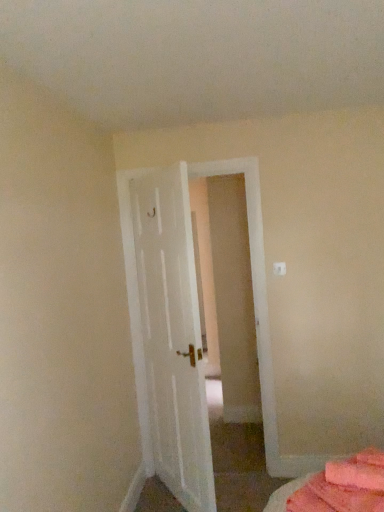
Describe the element at coordinates (135, 325) in the screenshot. I see `white painted wood door at center` at that location.

This screenshot has height=512, width=384. I want to click on white painted wood door at center, so click(135, 325).

What is the approximate height of white painted wood door at center?

white painted wood door at center is 6.88 feet tall.

What is the approximate width of pink fabric bed at lower right?

It is 11.65 inches.

Identify the location of pink fabric bed at lower right. This screenshot has width=384, height=512. (344, 486).

What do you see at coordinates (344, 486) in the screenshot? I see `pink fabric bed at lower right` at bounding box center [344, 486].

Measure the distance between point (345, 463) and camera.

The distance of point (345, 463) from camera is 1.49 meters.

At what (x,y) coordinates should I click in order to perform the action: click on white painted wood door at center. Please return your answer as a coordinate pair (x, y). The width and height of the screenshot is (384, 512). Looking at the image, I should click on (135, 325).

Which object is positioned more to the left, white painted wood door at center or pink fabric bed at lower right?

white painted wood door at center.

Considering the positions of objects white painted wood door at center and pink fabric bed at lower right in the image provided, who is behind, white painted wood door at center or pink fabric bed at lower right?

white painted wood door at center is behind.

Is point (215, 164) less distant than point (382, 487)?

No.

From the image's perspective, which is below, white painted wood door at center or pink fabric bed at lower right?

pink fabric bed at lower right is shown below in the image.

From a real-world perspective, is white painted wood door at center below pink fabric bed at lower right?

No.

Does white painted wood door at center have a greater width compared to pink fabric bed at lower right?

No.

In the scene shown: Considering the sizes of objects white painted wood door at center and pink fabric bed at lower right in the image provided, who is shorter, white painted wood door at center or pink fabric bed at lower right?

pink fabric bed at lower right is shorter.

Between white painted wood door at center and pink fabric bed at lower right, which one has smaller size?

With smaller size is pink fabric bed at lower right.

Is white painted wood door at center inside or outside of pink fabric bed at lower right?

white painted wood door at center is not inside pink fabric bed at lower right, it's outside.

From the picture: Is white painted wood door at center positioned far away from pink fabric bed at lower right?

white painted wood door at center is far away from pink fabric bed at lower right.

Is white painted wood door at center looking in the opposite direction of pink fabric bed at lower right?

No, white painted wood door at center's orientation is not away from pink fabric bed at lower right.

How distant is white painted wood door at center from pink fabric bed at lower right?

white painted wood door at center and pink fabric bed at lower right are 5.38 feet apart from each other.

You are a GUI agent. You are given a task and a screenshot of the screen. Output one action in this format:
    pyautogui.click(x=<x>, y=<y>)
    Task: Click on the bed below the white painted wood door at center (from the image's perspective)
    This screenshot has height=512, width=384.
    Given the screenshot: What is the action you would take?
    pyautogui.click(x=344, y=486)

Which is more to the right, pink fabric bed at lower right or white painted wood door at center?

Positioned to the right is pink fabric bed at lower right.

Consider the image. Relative to white painted wood door at center, is pink fabric bed at lower right in front or behind?

pink fabric bed at lower right is positioned closer to the viewer than white painted wood door at center.

Does point (356, 496) come closer to viewer compared to point (130, 492)?

Yes, point (356, 496) is in front of point (130, 492).

From the image's perspective, is pink fabric bed at lower right on top of white painted wood door at center?

No, from the image's perspective, pink fabric bed at lower right is not on top of white painted wood door at center.

From a real-world perspective, does pink fabric bed at lower right stand above white painted wood door at center?

No, from a real-world perspective, pink fabric bed at lower right is not over white painted wood door at center

Does pink fabric bed at lower right have a greater width compared to white painted wood door at center?

Yes.

In terms of height, does pink fabric bed at lower right look taller or shorter compared to white painted wood door at center?

Considering their sizes, pink fabric bed at lower right has less height than white painted wood door at center.

Considering the sizes of pink fabric bed at lower right and white painted wood door at center in the image, is pink fabric bed at lower right bigger or smaller than white painted wood door at center?

pink fabric bed at lower right is smaller than white painted wood door at center.

Is white painted wood door at center inside pink fabric bed at lower right?

No.

Is pink fabric bed at lower right directly adjacent to white painted wood door at center?

No, pink fabric bed at lower right is not touching white painted wood door at center.

Is white painted wood door at center at the back of pink fabric bed at lower right?

pink fabric bed at lower right is not turned away from white painted wood door at center.

How many degrees apart are the facing directions of pink fabric bed at lower right and white painted wood door at center?

The facing directions of pink fabric bed at lower right and white painted wood door at center are 142 degrees apart.

Measure the distance between pink fabric bed at lower right and white painted wood door at center.

pink fabric bed at lower right is 5.38 feet from white painted wood door at center.

At what (x,y) coordinates should I click in order to perform the action: click on bed on the right side of white painted wood door at center. Please return your answer as a coordinate pair (x, y). Looking at the image, I should click on (344, 486).

This screenshot has height=512, width=384. What are the coordinates of `bed directly beneath the white painted wood door at center (from a real-world perspective)` in the screenshot? It's located at (344, 486).

You are a GUI agent. You are given a task and a screenshot of the screen. Output one action in this format:
    pyautogui.click(x=<x>, y=<y>)
    Task: Click on the door positioned vertically above the pink fabric bed at lower right (from a real-world perspective)
    
    Given the screenshot: What is the action you would take?
    pyautogui.click(x=135, y=325)